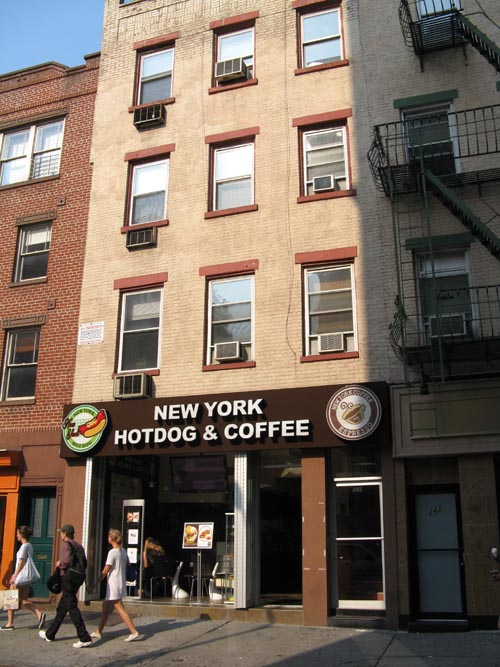
Image resolution: width=500 pixels, height=667 pixels. Identify the location of 4th floor window. (12, 169), (47, 167), (154, 87), (241, 47), (313, 33), (433, 7).